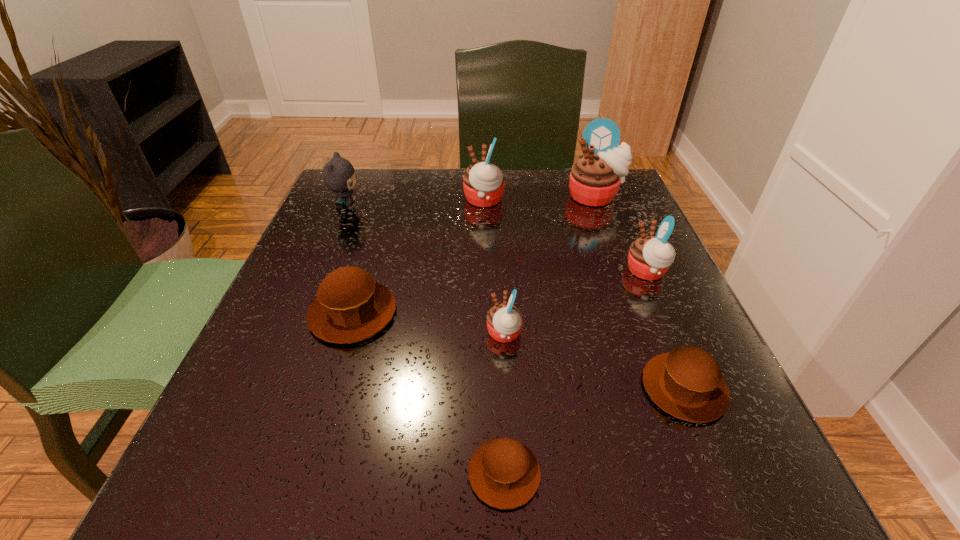
At what (x,y) coordinates should I click in order to perform the action: click on vacant space that satisfies the following two spatial constraints: 1. on the front-facing side of the tallest muffin; 2. on the left side of the second nearest brown muffin. Please return your answer as a coordinate pair (x, y). Looking at the image, I should click on (668, 388).

Identify the location of free location that satisfies the following two spatial constraints: 1. on the front-facing side of the tallest muffin; 2. on the front-facing side of the nearest pink muffin. This screenshot has width=960, height=540. (648, 334).

Find the location of a particular element. The height and width of the screenshot is (540, 960). vacant point that satisfies the following two spatial constraints: 1. on the back side of the farthest brown muffin; 2. on the front-facing side of the gray kitten is located at coordinates (x=385, y=207).

This screenshot has width=960, height=540. In order to click on free space that satisfies the following two spatial constraints: 1. on the front-facing side of the tallest object; 2. on the front-facing side of the nearest pink muffin in this screenshot , I will do `click(648, 334)`.

Image resolution: width=960 pixels, height=540 pixels. I want to click on free location that satisfies the following two spatial constraints: 1. on the front-facing side of the tallest object; 2. on the front-facing side of the sixth shortest muffin, so click(597, 200).

At what (x,y) coordinates should I click in order to perform the action: click on free location that satisfies the following two spatial constraints: 1. on the front-facing side of the tallest object; 2. on the front-facing side of the sixth shortest muffin. Please return your answer as a coordinate pair (x, y). Looking at the image, I should click on (597, 200).